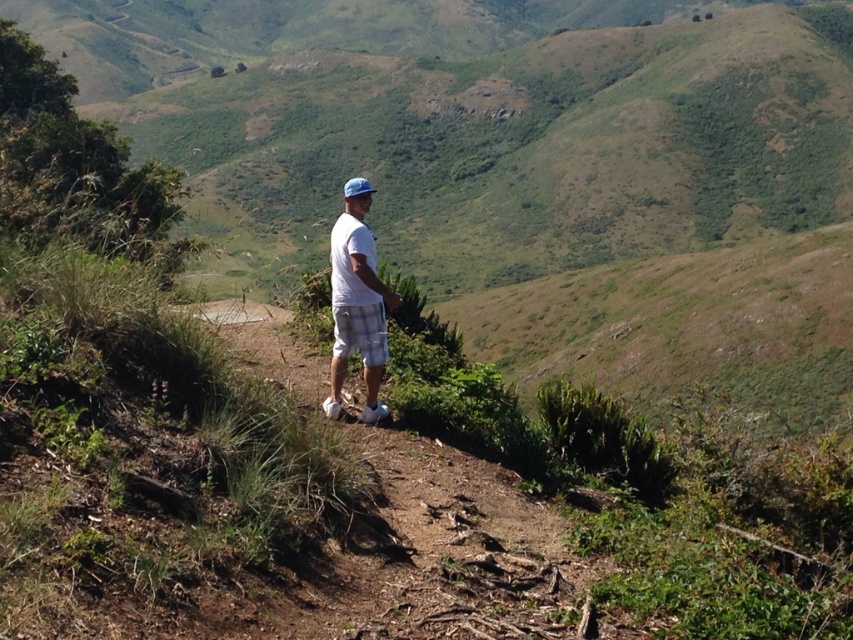
Which is below, white cotton shirt at center or white checkered shorts at center?

white checkered shorts at center is lower down.

Can you confirm if white cotton shirt at center is positioned to the left of white checkered shorts at center?

Yes, white cotton shirt at center is to the left of white checkered shorts at center.

In order to click on white cotton shirt at center in this screenshot , I will do `click(357, 301)`.